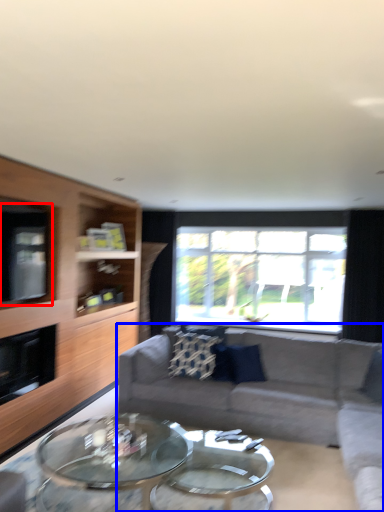
Question: Which object is closer to the camera taking this photo, window screen (highlighted by a red box) or studio couch (highlighted by a blue box)?

Choices:
 (A) window screen
 (B) studio couch

Answer: (B)